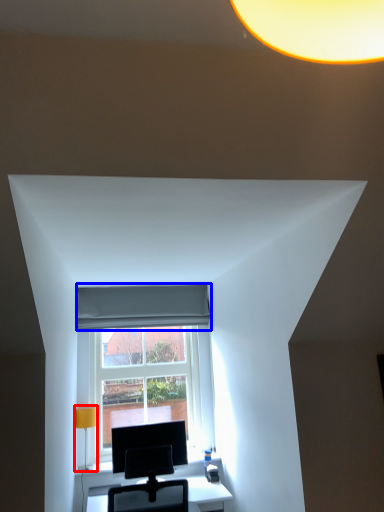
Question: Among these objects, which one is farthest to the camera, table lamp (highlighted by a red box) or curtain (highlighted by a blue box)?

Choices:
 (A) table lamp
 (B) curtain

Answer: (B)